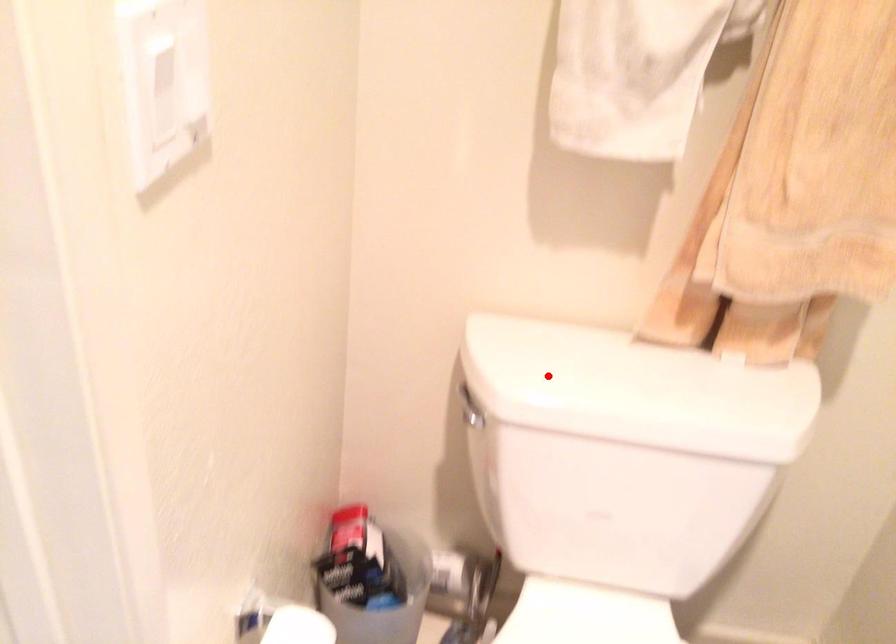
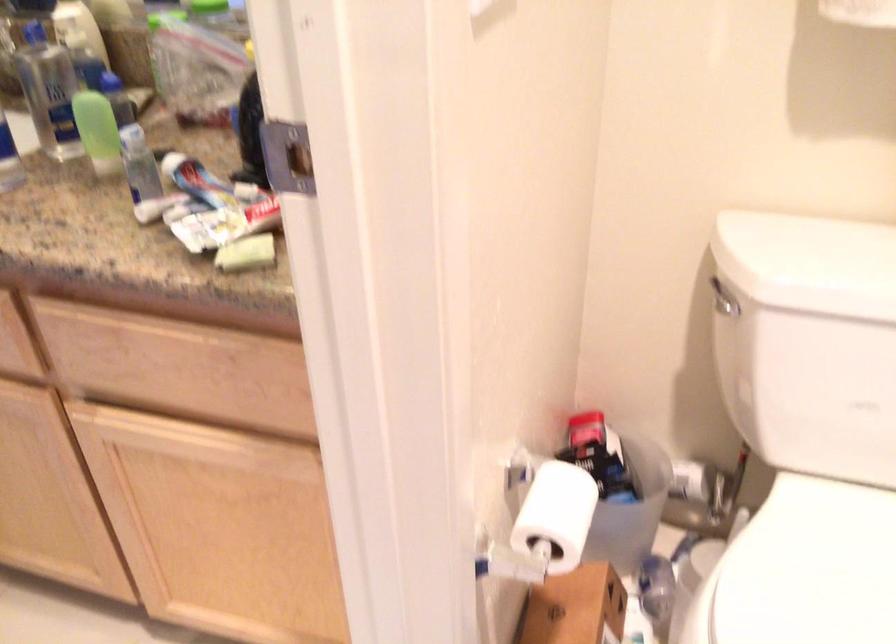
The point at the highlighted location is marked in the first image. Where is the corresponding point in the second image?

(810, 263)